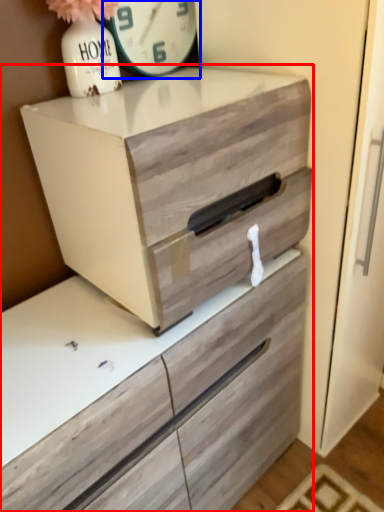
Question: Which object appears farthest to the camera in this image, chest of drawers (highlighted by a red box) or clock (highlighted by a blue box)?

Choices:
 (A) chest of drawers
 (B) clock

Answer: (B)